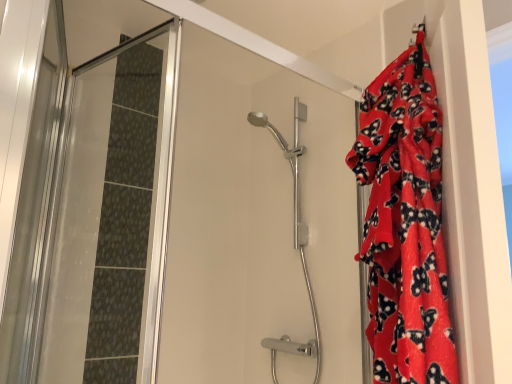
Question: Is transparent glass shower door at left taller or shorter than red fleece blanket at right?

Choices:
 (A) short
 (B) tall

Answer: (B)

Question: Based on their sizes in the image, would you say transparent glass shower door at left is bigger or smaller than red fleece blanket at right?

Choices:
 (A) small
 (B) big

Answer: (A)

Question: Based on their relative distances, which object is nearer to the transparent glass shower door at left?

Choices:
 (A) polished chrome shower head at center
 (B) red fleece blanket at right

Answer: (A)

Question: Which object is positioned closest to the polished chrome shower head at center?

Choices:
 (A) red fleece blanket at right
 (B) transparent glass shower door at left

Answer: (B)